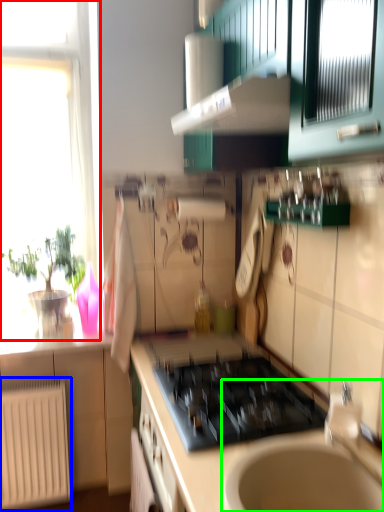
Question: Considering the real-world distances, which object is closest to window (highlighted by a red box)? radiator (highlighted by a blue box) or sink (highlighted by a green box).

Choices:
 (A) radiator
 (B) sink

Answer: (A)